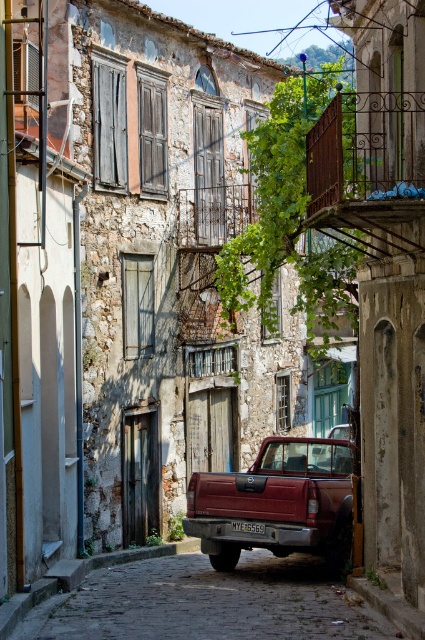
Question: Is matte red truck at center below black plastic license plate at center?

Choices:
 (A) no
 (B) yes

Answer: (A)

Question: Which is nearer to the black plastic license plate at center?

Choices:
 (A) matte red truck at center
 (B) rustic stone cobblestone street at center

Answer: (A)

Question: Does matte red truck at center come behind black plastic license plate at center?

Choices:
 (A) yes
 (B) no

Answer: (B)

Question: Which object is the farthest from the black plastic license plate at center?

Choices:
 (A) rustic stone cobblestone street at center
 (B) matte red truck at center

Answer: (A)

Question: Which object is positioned farthest from the black plastic license plate at center?

Choices:
 (A) matte red truck at center
 (B) rustic stone cobblestone street at center

Answer: (B)

Question: Is rustic stone cobblestone street at center closer to camera compared to black plastic license plate at center?

Choices:
 (A) yes
 (B) no

Answer: (A)